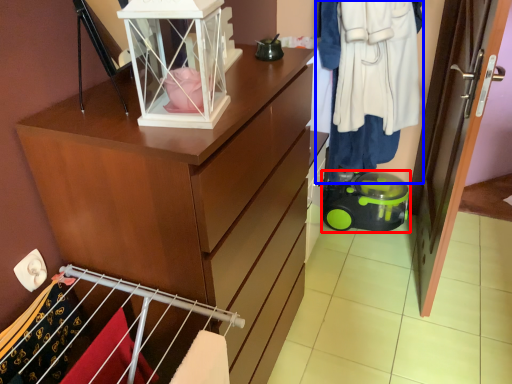
Question: Among these objects, which one is farthest to the camera, toy (highlighted by a red box) or clothing (highlighted by a blue box)?

Choices:
 (A) toy
 (B) clothing

Answer: (A)